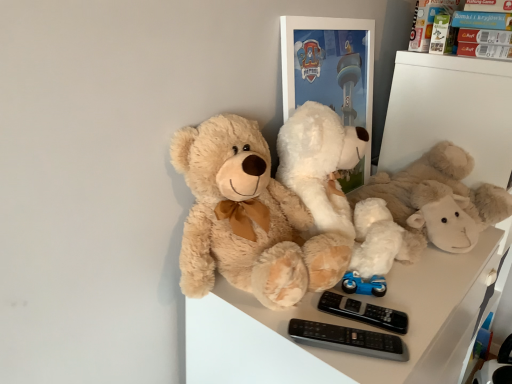
What is the approximate height of matte cardboard box at upper right?

matte cardboard box at upper right is 6.83 inches in height.

Measure the distance between point (317, 267) and camera.

Point (317, 267) is 34.13 inches from camera.

Where is `black plastic remote controls at lower center`? This screenshot has width=512, height=384. black plastic remote controls at lower center is located at coordinates (348, 339).

What is the approximate height of white plush toy at center, which appears as the first teddy bear when viewed from the right?

white plush toy at center, which appears as the first teddy bear when viewed from the right, is 9.05 inches in height.

Locate an element on the screen. The image size is (512, 384). matte cardboard box at upper right is located at coordinates (451, 25).

Is matte cardboard box at upper right bigger than white plush toy at center, which appears as the first teddy bear when viewed from the right?

Incorrect, matte cardboard box at upper right is not larger than white plush toy at center, which appears as the first teddy bear when viewed from the right.

Considering the sizes of objects matte cardboard box at upper right and white plush toy at center, which appears as the first teddy bear when viewed from the right, in the image provided, who is thinner, matte cardboard box at upper right or white plush toy at center, which appears as the first teddy bear when viewed from the right,?

matte cardboard box at upper right is thinner.

Which is behind, point (461, 17) or point (384, 208)?

The point (461, 17) is farther.

Based on the photo, considering the sizes of black plastic remote at lower right and black plastic remote controls at lower center in the image, is black plastic remote at lower right wider or thinner than black plastic remote controls at lower center?

black plastic remote at lower right is thinner than black plastic remote controls at lower center.

Is black plastic remote at lower right oriented towards black plastic remote controls at lower center?

No, black plastic remote at lower right is not turned towards black plastic remote controls at lower center.

Could you measure the distance between black plastic remote at lower right and black plastic remote controls at lower center?

A distance of 3.01 inches exists between black plastic remote at lower right and black plastic remote controls at lower center.

Who is shorter, white plush toy at center, which appears as the second teddy bear when viewed from the left, or black plastic remote at lower right?

black plastic remote at lower right.

From a real-world perspective, is white plush toy at center, which appears as the second teddy bear when viewed from the left, located higher than black plastic remote at lower right?

Yes, from a real-world perspective, white plush toy at center, which appears as the second teddy bear when viewed from the left, is on top of black plastic remote at lower right.

Considering the relative sizes of white plush toy at center, which appears as the first teddy bear when viewed from the right, and black plastic remote at lower right in the image provided, is white plush toy at center, which appears as the first teddy bear when viewed from the right, smaller than black plastic remote at lower right?

Actually, white plush toy at center, which appears as the first teddy bear when viewed from the right, might be larger than black plastic remote at lower right.

Is white plush toy at center, which appears as the second teddy bear when viewed from the left, aimed at black plastic remote at lower right?

No, white plush toy at center, which appears as the second teddy bear when viewed from the left, is not turned towards black plastic remote at lower right.

From their relative heights in the image, would you say white plush toy at center, which appears as the second teddy bear when viewed from the left, is taller or shorter than fluffy beige teddy bear at center, positioned as the second teddy bear in right-to-left order?

In the image, white plush toy at center, which appears as the second teddy bear when viewed from the left, appears to be shorter than fluffy beige teddy bear at center, positioned as the second teddy bear in right-to-left order.

Which object is positioned more to the left, white plush toy at center, which appears as the second teddy bear when viewed from the left, or fluffy beige teddy bear at center, positioned as the second teddy bear in right-to-left order?

From the viewer's perspective, fluffy beige teddy bear at center, positioned as the second teddy bear in right-to-left order, appears more on the left side.

Who is bigger, white plush toy at center, which appears as the first teddy bear when viewed from the right, or fluffy beige teddy bear at center, positioned as the second teddy bear in right-to-left order?

Bigger between the two is white plush toy at center, which appears as the first teddy bear when viewed from the right.

Is white plush toy at center, which appears as the first teddy bear when viewed from the right, positioned in front of fluffy beige teddy bear at center, the first teddy bear in the left-to-right sequence?

That is False.

Is black plastic remote controls at lower center inside or outside of matte cardboard box at upper right?

black plastic remote controls at lower center exists outside the volume of matte cardboard box at upper right.

Between black plastic remote controls at lower center and matte cardboard box at upper right, which one is positioned in front?

black plastic remote controls at lower center is more forward.

From a real-world perspective, is black plastic remote controls at lower center below matte cardboard box at upper right?

Yes, from a real-world perspective, black plastic remote controls at lower center is under matte cardboard box at upper right.

Between black plastic remote controls at lower center and matte cardboard box at upper right, which one has smaller size?

black plastic remote controls at lower center is smaller.

From a real-world perspective, is black plastic remote at lower right beneath white plush toy at center, which appears as the first teddy bear when viewed from the right?

Indeed, from a real-world perspective, black plastic remote at lower right is positioned beneath white plush toy at center, which appears as the first teddy bear when viewed from the right.

Looking at this image, considering the relative positions of black plastic remote at lower right and white plush toy at center, which appears as the first teddy bear when viewed from the right, in the image provided, is black plastic remote at lower right to the left or to the right of white plush toy at center, which appears as the first teddy bear when viewed from the right,?

From the image, it's evident that black plastic remote at lower right is to the left of white plush toy at center, which appears as the first teddy bear when viewed from the right.

Considering the sizes of objects black plastic remote at lower right and white plush toy at center, which appears as the second teddy bear when viewed from the left, in the image provided, who is thinner, black plastic remote at lower right or white plush toy at center, which appears as the second teddy bear when viewed from the left,?

With smaller width is black plastic remote at lower right.

Does black plastic remote at lower right turn towards white plush toy at center, which appears as the first teddy bear when viewed from the right?

No, black plastic remote at lower right is not oriented towards white plush toy at center, which appears as the first teddy bear when viewed from the right.

Which of these two, matte cardboard box at upper right or black plastic remote at lower right, stands taller?

Standing taller between the two is matte cardboard box at upper right.

Is matte cardboard box at upper right far away from black plastic remote at lower right?

That's not correct — matte cardboard box at upper right is a little close to black plastic remote at lower right.

Considering the positions of objects matte cardboard box at upper right and black plastic remote at lower right in the image provided, who is behind, matte cardboard box at upper right or black plastic remote at lower right?

matte cardboard box at upper right is further from the camera.

What are the coordinates of `toy above the black plastic remote at lower right (from a real-world perspective)` in the screenshot? It's located at (451, 25).

The image size is (512, 384). In the image, there is a white plush toy at center, which appears as the first teddy bear when viewed from the right. In order to click on toy above it (from the image's perspective) in this screenshot , I will do `click(451, 25)`.

Find the location of a particular element. equipment to the left of black plastic remote at lower right is located at coordinates (348, 339).

Which object lies further to the anchor point black plastic remote controls at lower center, white plush toy at center, which appears as the second teddy bear when viewed from the left, or black plastic remote at lower right?

white plush toy at center, which appears as the second teddy bear when viewed from the left, lies further to black plastic remote controls at lower center than the other object.

Estimate the real-world distances between objects in this image. Which object is further from fluffy beige teddy bear at center, the first teddy bear in the left-to-right sequence, matte cardboard box at upper right or white plush toy at center, which appears as the first teddy bear when viewed from the right?

matte cardboard box at upper right.

Estimate the real-world distances between objects in this image. Which object is further from black plastic remote at lower right, white plush toy at center, which appears as the second teddy bear when viewed from the left, or black plastic remote controls at lower center?

The object further to black plastic remote at lower right is white plush toy at center, which appears as the second teddy bear when viewed from the left.

Which object lies further to the anchor point matte cardboard box at upper right, black plastic remote at lower right or black plastic remote controls at lower center?

black plastic remote controls at lower center is further to matte cardboard box at upper right.

Which object lies further to the anchor point black plastic remote controls at lower center, fluffy beige teddy bear at center, the first teddy bear in the left-to-right sequence, or white plush toy at center, which appears as the second teddy bear when viewed from the left?

The object further to black plastic remote controls at lower center is white plush toy at center, which appears as the second teddy bear when viewed from the left.

Based on their spatial positions, is matte cardboard box at upper right or black plastic remote at lower right further from fluffy beige teddy bear at center, the first teddy bear in the left-to-right sequence?

matte cardboard box at upper right lies further to fluffy beige teddy bear at center, the first teddy bear in the left-to-right sequence, than the other object.

Which object lies further to the anchor point matte cardboard box at upper right, black plastic remote at lower right or fluffy beige teddy bear at center, the first teddy bear in the left-to-right sequence?

black plastic remote at lower right lies further to matte cardboard box at upper right than the other object.

Considering their positions, is fluffy beige teddy bear at center, positioned as the second teddy bear in right-to-left order, positioned further to white plush toy at center, which appears as the first teddy bear when viewed from the right, than black plastic remote at lower right?

black plastic remote at lower right is positioned further to the anchor white plush toy at center, which appears as the first teddy bear when viewed from the right.

The width and height of the screenshot is (512, 384). What are the coordinates of `control located between fluffy beige teddy bear at center, positioned as the second teddy bear in right-to-left order, and white plush toy at center, which appears as the first teddy bear when viewed from the right, in the left-right direction` in the screenshot? It's located at (364, 312).

This screenshot has width=512, height=384. I want to click on control between fluffy beige teddy bear at center, the first teddy bear in the left-to-right sequence, and black plastic remote controls at lower center from top to bottom, so click(x=364, y=312).

Locate an element on the screen. The height and width of the screenshot is (384, 512). control between matte cardboard box at upper right and black plastic remote controls at lower center in the up-down direction is located at coordinates (364, 312).

Image resolution: width=512 pixels, height=384 pixels. Identify the location of control between black plastic remote controls at lower center and white plush toy at center, which appears as the first teddy bear when viewed from the right, from left to right. (364, 312).